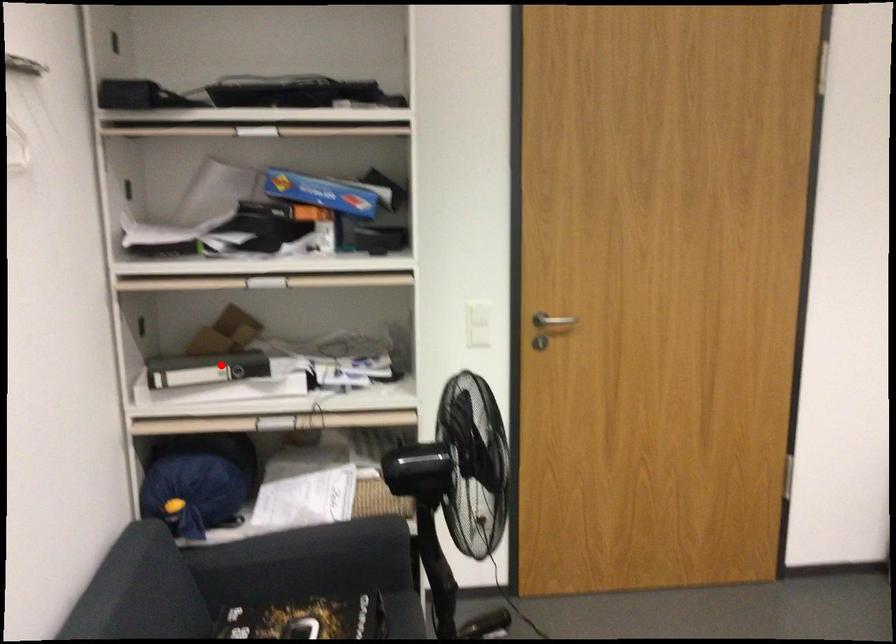
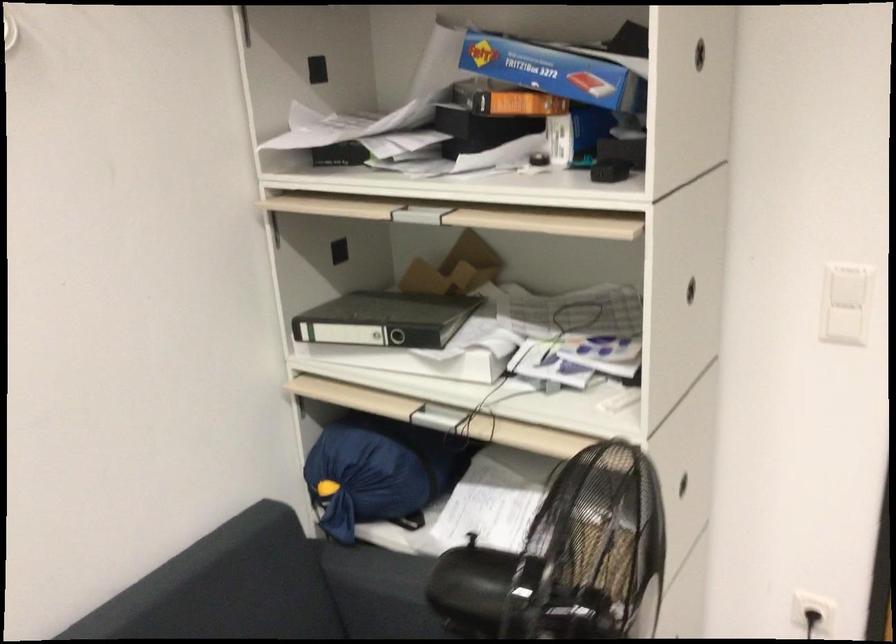
Find the pixel in the second image that matches the highlighted location in the first image.

(385, 319)